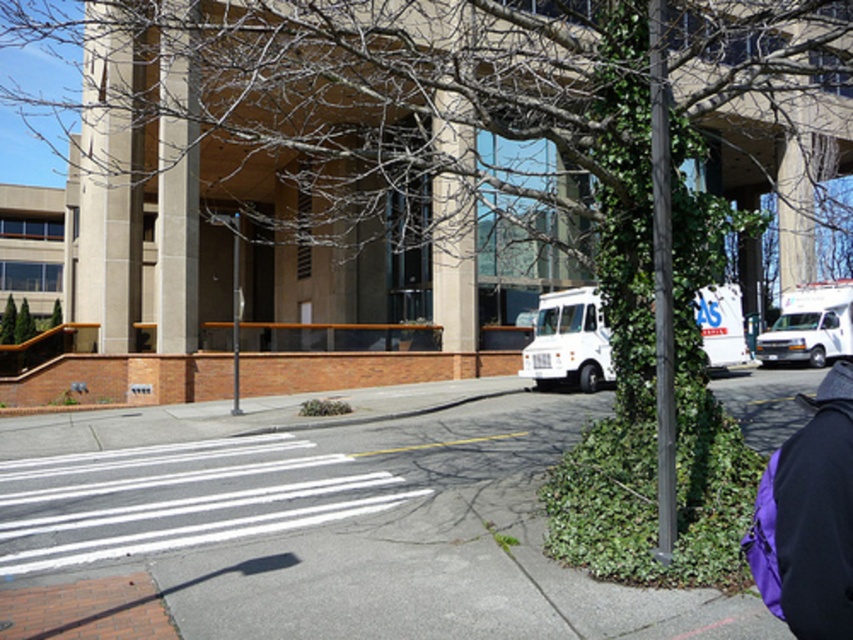
Does white matte truck at center-right appear over white matte van at right?

Indeed, white matte truck at center-right is positioned over white matte van at right.

Can you confirm if white matte truck at center-right is bigger than white matte van at right?

Yes, white matte truck at center-right is bigger than white matte van at right.

Who is more forward, (561, 340) or (822, 321)?

Positioned in front is point (561, 340).

Where is `white matte truck at center-right`? The image size is (853, 640). white matte truck at center-right is located at coordinates (569, 340).

Does point (817, 508) come in front of point (170, 168)?

Yes, it is in front of point (170, 168).

Does point (843, 506) come farther from viewer compared to point (175, 124)?

No, (843, 506) is closer to viewer.

You are a GUI agent. You are given a task and a screenshot of the screen. Output one action in this format:
    pyautogui.click(x=<x>, y=<y>)
    Task: Click on the purple fleece sweatshirt at lower right
    
    Given the screenshot: What is the action you would take?
    pyautogui.click(x=817, y=513)

Who is positioned more to the right, concrete column at center or white matte truck at center-right?

white matte truck at center-right

Does concrete column at center appear on the left side of white matte truck at center-right?

Correct, you'll find concrete column at center to the left of white matte truck at center-right.

Which is behind, point (187, 292) or point (546, 321)?

Point (546, 321)

The height and width of the screenshot is (640, 853). In order to click on concrete column at center in this screenshot , I will do `click(177, 182)`.